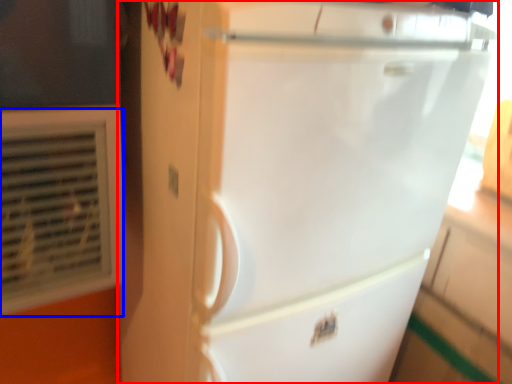
Question: Which point is further to the camera, refrigerator (highlighted by a red box) or air conditioning (highlighted by a blue box)?

Choices:
 (A) refrigerator
 (B) air conditioning

Answer: (B)